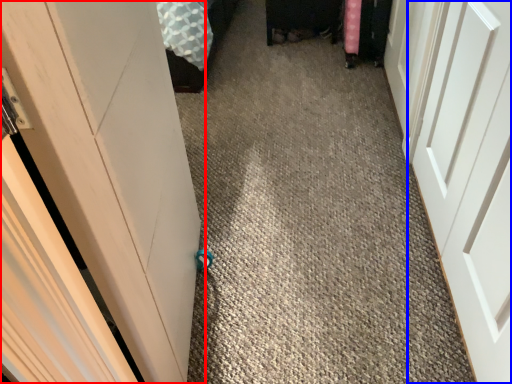
Question: Which object is closer to the camera taking this photo, door (highlighted by a red box) or door (highlighted by a blue box)?

Choices:
 (A) door
 (B) door

Answer: (A)